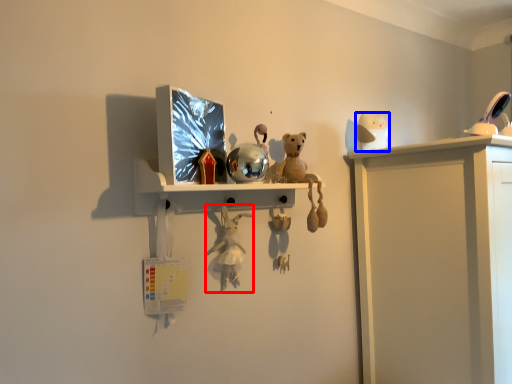
Question: Which point is closer to the camera, toy (highlighted by a red box) or toy (highlighted by a blue box)?

Choices:
 (A) toy
 (B) toy

Answer: (A)